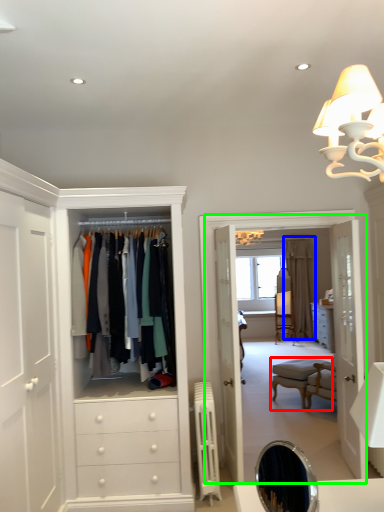
Question: Which object is the closest to the vanity (highlighted by a red box)? Choose among these: curtain (highlighted by a blue box) or boutique (highlighted by a green box).

Choices:
 (A) curtain
 (B) boutique

Answer: (B)